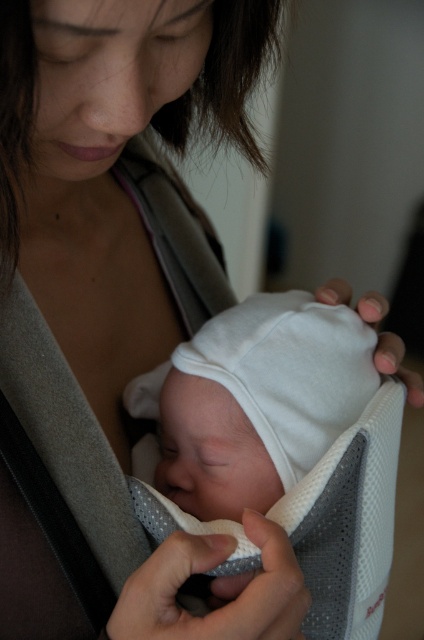
Question: Which point appears closest to the camera in this image?

Choices:
 (A) coord(187,412)
 (B) coord(187,289)

Answer: (A)

Question: Which point is farther to the camera?

Choices:
 (A) gray fabric strap at center
 (B) white soft hat at center

Answer: (A)

Question: Can you confirm if white soft hat at center is wider than gray fabric strap at center?

Choices:
 (A) yes
 (B) no

Answer: (A)

Question: Is white soft hat at center further to camera compared to gray fabric strap at center?

Choices:
 (A) yes
 (B) no

Answer: (B)

Question: Does white soft hat at center have a lesser width compared to gray fabric strap at center?

Choices:
 (A) yes
 (B) no

Answer: (B)